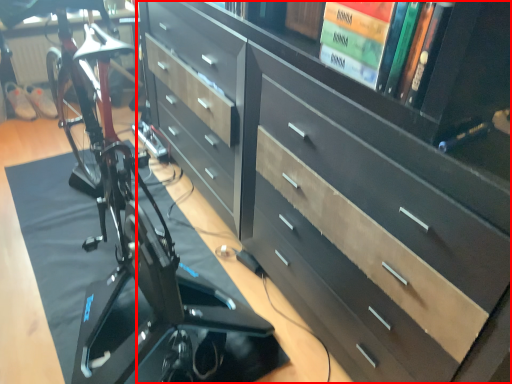
Question: From the image's perspective, what is the correct spatial relationship of chest of drawers (annotated by the red box) in relation to bicycle?

Choices:
 (A) below
 (B) above

Answer: (B)